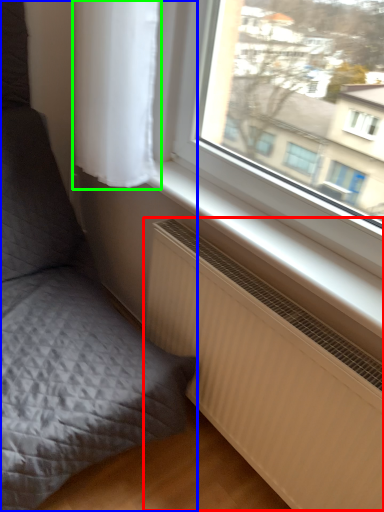
Question: Which is farther away from radiator (highlighted by a red box)? furniture (highlighted by a blue box) or curtain (highlighted by a green box)?

Choices:
 (A) furniture
 (B) curtain

Answer: (B)